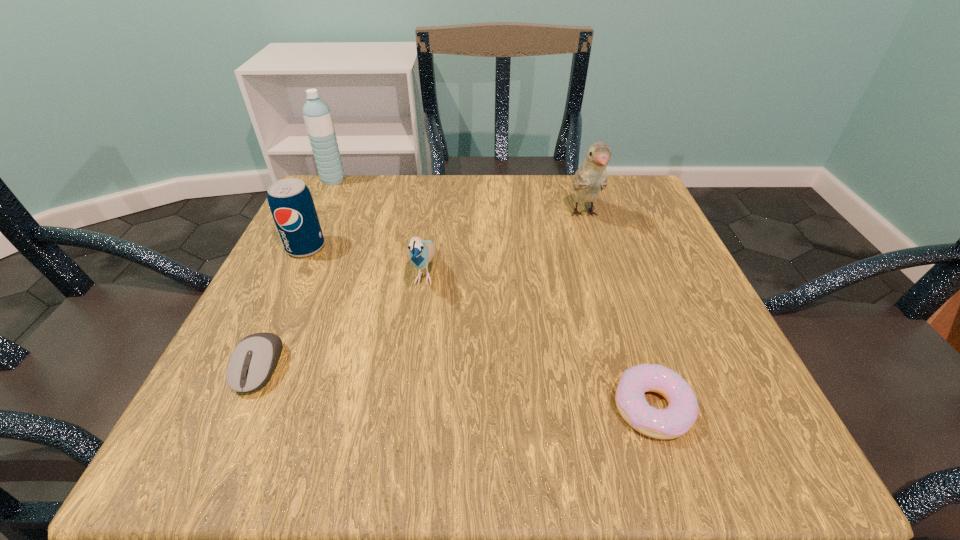
Image resolution: width=960 pixels, height=540 pixels. Find the location of `free spot that satisfies the following two spatial constraints: 1. at the face of the left bird; 2. on the left side of the doughnut`. free spot that satisfies the following two spatial constraints: 1. at the face of the left bird; 2. on the left side of the doughnut is located at coordinates (405, 408).